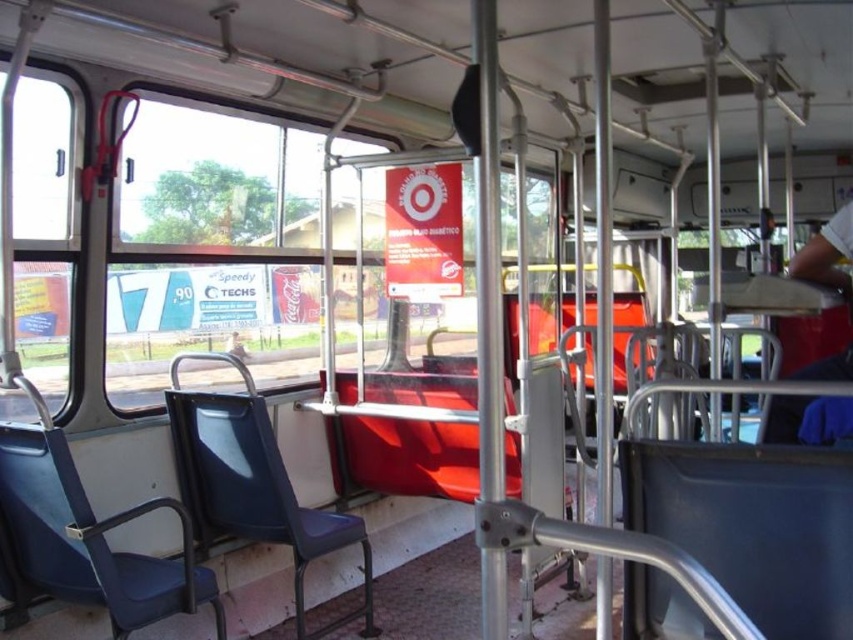
From the picture: You are a passenger on a public bus and want to look outside. Where should you go to find the transparent glass window at center?

The transparent glass window at center is located at point (212, 244).

Based on the photo, you are a passenger on the bus and want to know which object is wider between the transparent glass window at center and the blue plastic chair at lower right. Which one is wider?

The blue plastic chair at lower right is wider than the transparent glass window at center.